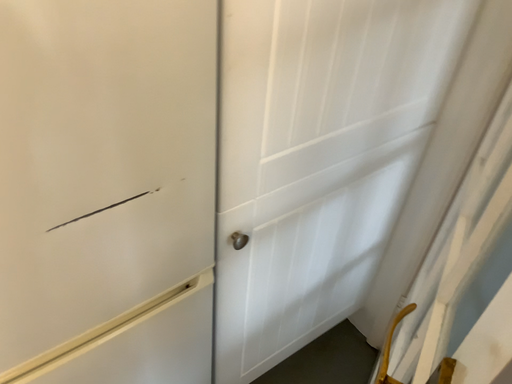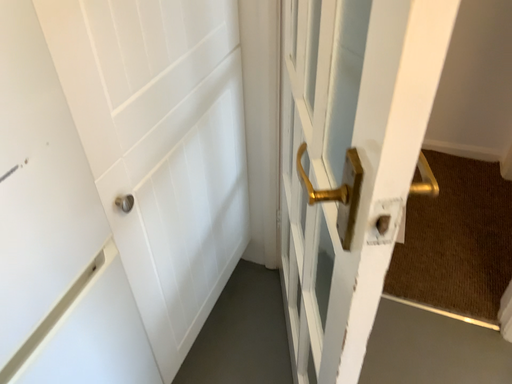
Question: Which way did the camera rotate in the video?

Choices:
 (A) rotated left
 (B) rotated right

Answer: (B)